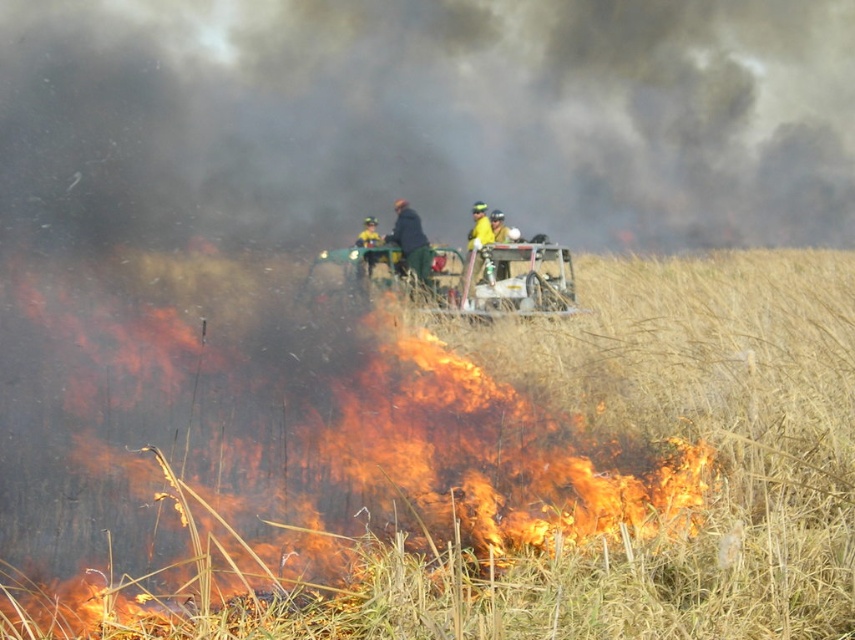
Question: Among these objects, which one is nearest to the camera?

Choices:
 (A) dark blue jacket at center
 (B) yellow fabric helmet at center
 (C) yellow reflective jacket at center
 (D) flaming grass at center

Answer: (A)

Question: Which object appears farthest from the camera in this image?

Choices:
 (A) yellow reflective vest at center
 (B) flaming grass at center

Answer: (A)

Question: Can you confirm if flaming grass at center is positioned to the left of yellow fabric helmet at center?

Choices:
 (A) no
 (B) yes

Answer: (A)

Question: Can you confirm if yellow fabric helmet at center is positioned to the right of yellow reflective vest at center?

Choices:
 (A) no
 (B) yes

Answer: (A)

Question: Which point appears closest to the camera in this image?

Choices:
 (A) (402, 220)
 (B) (496, 269)
 (C) (364, 244)
 (D) (475, 221)

Answer: (B)

Question: Observing the image, what is the correct spatial positioning of yellow reflective vest at center in reference to yellow reflective jacket at center?

Choices:
 (A) right
 (B) left

Answer: (A)